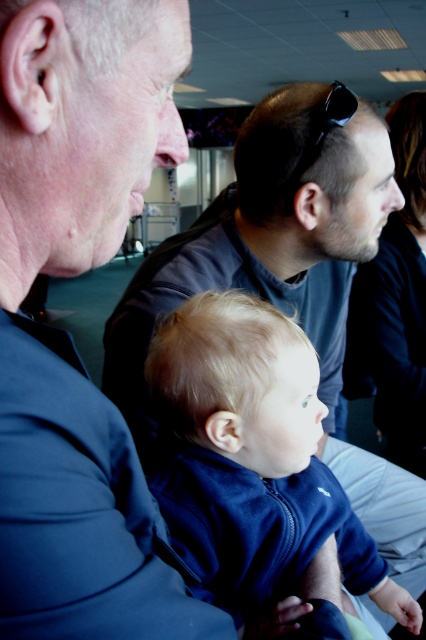
You are a photographer trying to capture a candid shot of the baby in the image. You notice the blue fleece jacket at center and the black plastic sunglasses at upper center. Which object is positioned higher in the frame?

The blue fleece jacket at center is much taller than the black plastic sunglasses at upper center, so the blue fleece jacket at center is positioned higher in the frame.

You are a traveler carrying a backpack that is 24 inches wide. You are standing in front of the blue fleece jacket at center. Can you place your backpack next to it without moving the jacket?

The blue fleece jacket at center is 23.90 inches from viewer, so the backpack is wider than the jacket. Therefore, the backpack cannot be placed next to it without moving the jacket.

You are a photographer trying to capture a closeup of the baby in the image. You have two focus points available at the coordinates point (285, 564) and point (340, 116). Which focus point should you choose to ensure the baby is in focus?

Point (285, 564) is closer to the camera than point (340, 116), so you should choose point (285, 564) to ensure the baby is in focus.